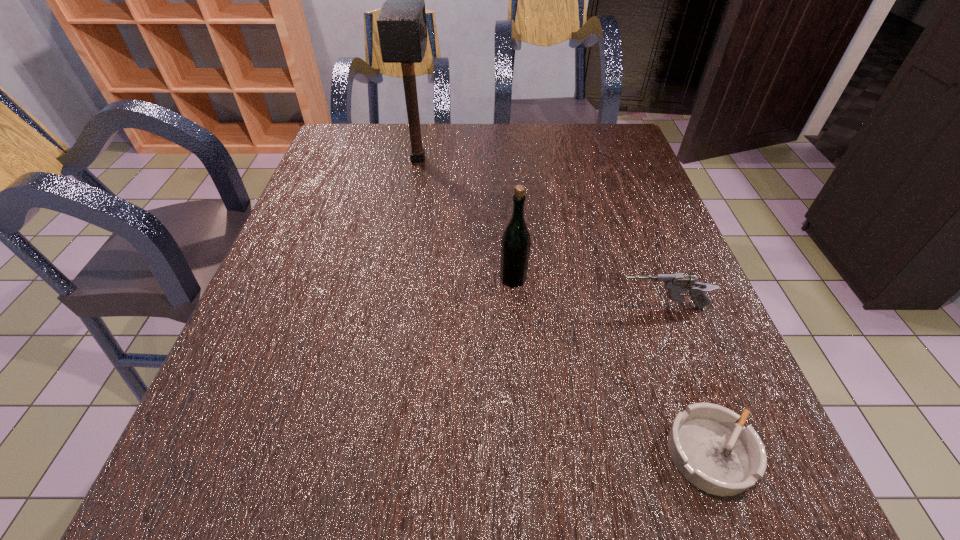
Where is `free space between the beer bottle and the second nearest object`? free space between the beer bottle and the second nearest object is located at coordinates (588, 293).

The image size is (960, 540). In order to click on free space between the third tallest object and the leftmost object in this screenshot , I will do `click(540, 233)`.

Locate an element on the screen. free space between the ashtray and the beer bottle is located at coordinates (612, 366).

Find the location of `free space between the shortest object and the gun`. free space between the shortest object and the gun is located at coordinates 685,380.

This screenshot has height=540, width=960. In order to click on free space between the shortest object and the third tallest object in this screenshot , I will do `click(685, 380)`.

This screenshot has width=960, height=540. I want to click on empty space that is in between the mallet and the second object from left to right, so click(x=466, y=219).

This screenshot has height=540, width=960. Find the location of `the third closest object to the gun`. the third closest object to the gun is located at coordinates (401, 22).

Select which object appears as the third closest to the third shortest object. Please provide its 2D coordinates. Your answer should be formatted as a tuple, i.e. [(x, y)], where the tuple contains the x and y coordinates of a point satisfying the conditions above.

[(401, 22)]

I want to click on vacant region that satisfies the following two spatial constraints: 1. on the front side of the mallet; 2. on the right side of the second tallest object, so click(396, 279).

This screenshot has width=960, height=540. What are the coordinates of `vacant space that satisfies the following two spatial constraints: 1. on the front side of the second farthest object; 2. on the left side of the mallet` in the screenshot? It's located at (396, 279).